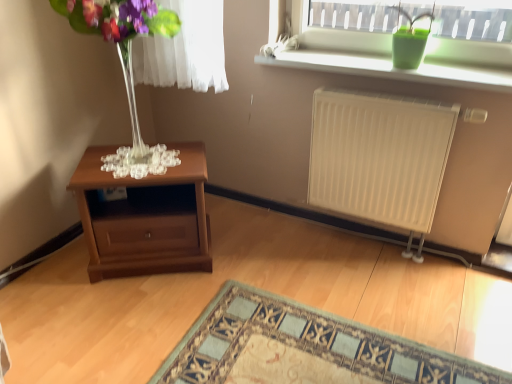
The height and width of the screenshot is (384, 512). In order to click on vacant space that is in between mahogany wood nightstand at lower left and carpet with intricate pattern at lower center in this screenshot , I will do `click(247, 284)`.